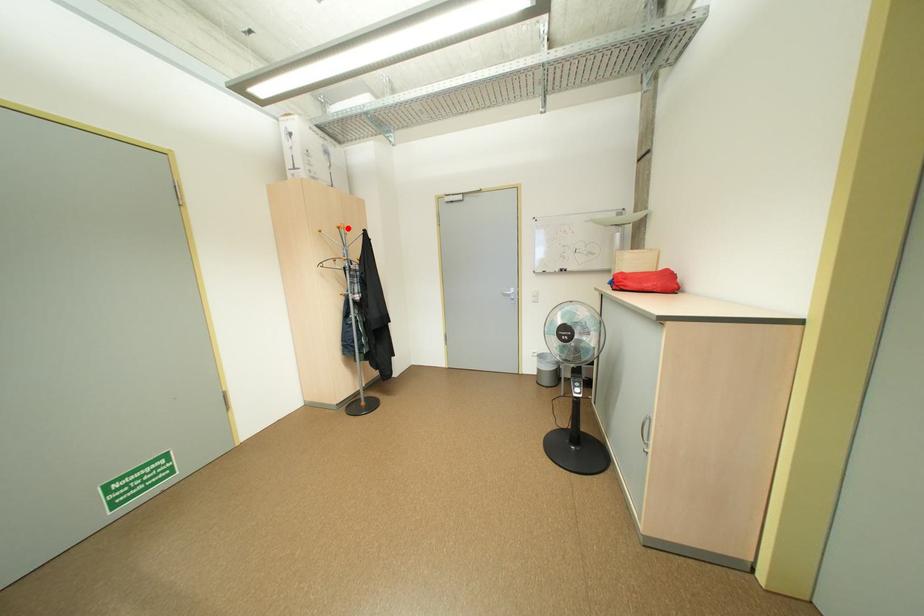
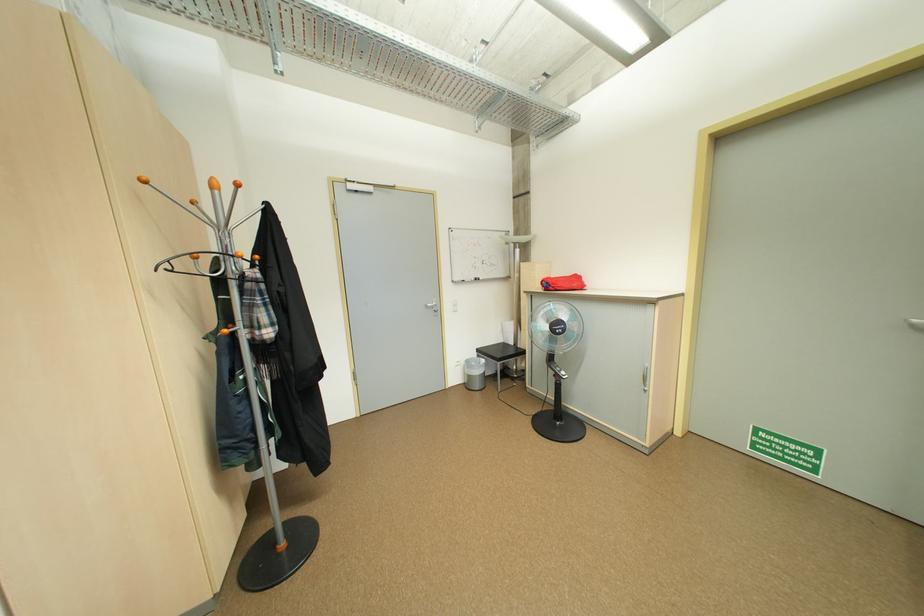
Where in the second image is the point corresponding to the highlighted location from the first image?

(247, 185)